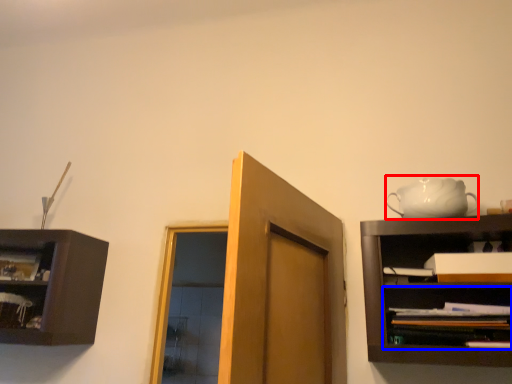
Question: Which point is closer to the camera, tea set (highlighted by a red box) or shelf (highlighted by a blue box)?

Choices:
 (A) tea set
 (B) shelf

Answer: (B)